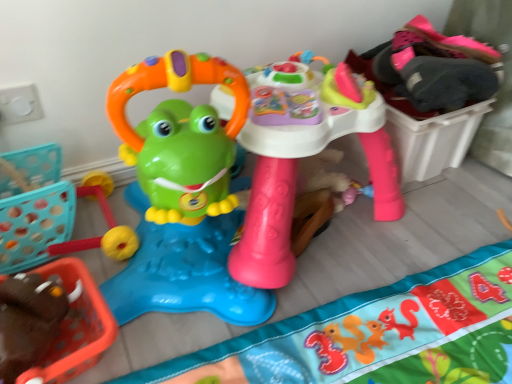
Question: Is the position of matte plastic frog walker at center, the 1th toy in the left-to-right sequence, less distant than that of matte plastic activity table at center, placed as the 1th toy when sorted from right to left?

Choices:
 (A) yes
 (B) no

Answer: (A)

Question: Does matte plastic frog walker at center, the 1th toy in the left-to-right sequence, have a greater width compared to matte plastic activity table at center, placed as the 1th toy when sorted from right to left?

Choices:
 (A) no
 (B) yes

Answer: (A)

Question: Does matte plastic frog walker at center, the second toy from the right, appear on the right side of matte plastic activity table at center, which is the second toy from left to right?

Choices:
 (A) yes
 (B) no

Answer: (B)

Question: Is matte plastic frog walker at center, the 1th toy in the left-to-right sequence, bigger than matte plastic activity table at center, which is the second toy from left to right?

Choices:
 (A) yes
 (B) no

Answer: (B)

Question: Is matte plastic frog walker at center, the second toy from the right, positioned with its back to matte plastic activity table at center, placed as the 1th toy when sorted from right to left?

Choices:
 (A) no
 (B) yes

Answer: (A)

Question: From a real-world perspective, is matte plastic frog walker at center, the second toy from the right, located higher than matte plastic activity table at center, placed as the 1th toy when sorted from right to left?

Choices:
 (A) no
 (B) yes

Answer: (B)

Question: From a real-world perspective, does matte plastic activity table at center, placed as the 1th toy when sorted from right to left, stand above soft fabric play mat at center?

Choices:
 (A) no
 (B) yes

Answer: (B)

Question: Can you confirm if matte plastic activity table at center, placed as the 1th toy when sorted from right to left, is shorter than soft fabric play mat at center?

Choices:
 (A) no
 (B) yes

Answer: (A)

Question: Does matte plastic activity table at center, placed as the 1th toy when sorted from right to left, lie in front of soft fabric play mat at center?

Choices:
 (A) yes
 (B) no

Answer: (B)

Question: Is there a large distance between matte plastic activity table at center, placed as the 1th toy when sorted from right to left, and soft fabric play mat at center?

Choices:
 (A) yes
 (B) no

Answer: (B)

Question: Considering the relative sizes of matte plastic activity table at center, which is the second toy from left to right, and soft fabric play mat at center in the image provided, is matte plastic activity table at center, which is the second toy from left to right, bigger than soft fabric play mat at center?

Choices:
 (A) yes
 (B) no

Answer: (A)

Question: Could soft fabric play mat at center be considered to be inside matte plastic activity table at center, placed as the 1th toy when sorted from right to left?

Choices:
 (A) yes
 (B) no

Answer: (B)

Question: Is soft fabric play mat at center positioned with its back to matte plastic frog walker at center, the 1th toy in the left-to-right sequence?

Choices:
 (A) yes
 (B) no

Answer: (B)